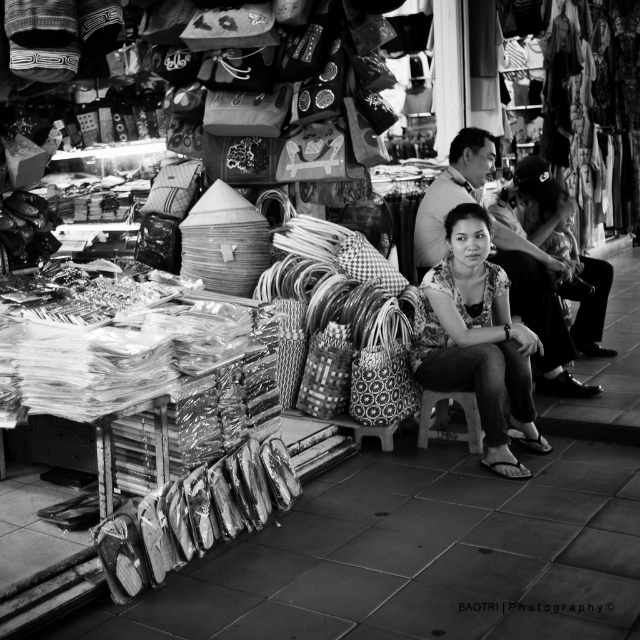
Find the location of `printed fabric blouse at center`. printed fabric blouse at center is located at coordinates (477, 340).

Who is more distant from viewer, (477, 364) or (544, 294)?

The point (544, 294) is more distant.

This screenshot has height=640, width=640. What are the coordinates of `printed fabric blouse at center` in the screenshot? It's located at click(477, 340).

Is point (435, 321) farther from viewer compared to point (467, 420)?

No, (435, 321) is closer to viewer.

Based on the photo, does printed fabric blouse at center have a larger size compared to wooden stool at center?

Correct, printed fabric blouse at center is larger in size than wooden stool at center.

Between point (497, 404) and point (424, 403), which one is positioned in front?

Point (497, 404) is more forward.

You are a GUI agent. You are given a task and a screenshot of the screen. Output one action in this format:
    pyautogui.click(x=<x>, y=<y>)
    Task: Click on the printed fabric blouse at center
    This screenshot has width=640, height=640.
    Given the screenshot: What is the action you would take?
    pyautogui.click(x=477, y=340)

Can you confirm if smooth leather jacket at center is taller than wooden stool at center?

Yes.

What are the coordinates of `smooth leather jacket at center` in the screenshot? It's located at (540, 308).

The image size is (640, 640). Identify the location of smooth leather jacket at center. (540, 308).

This screenshot has height=640, width=640. Identify the location of smooth leather jacket at center. (540, 308).